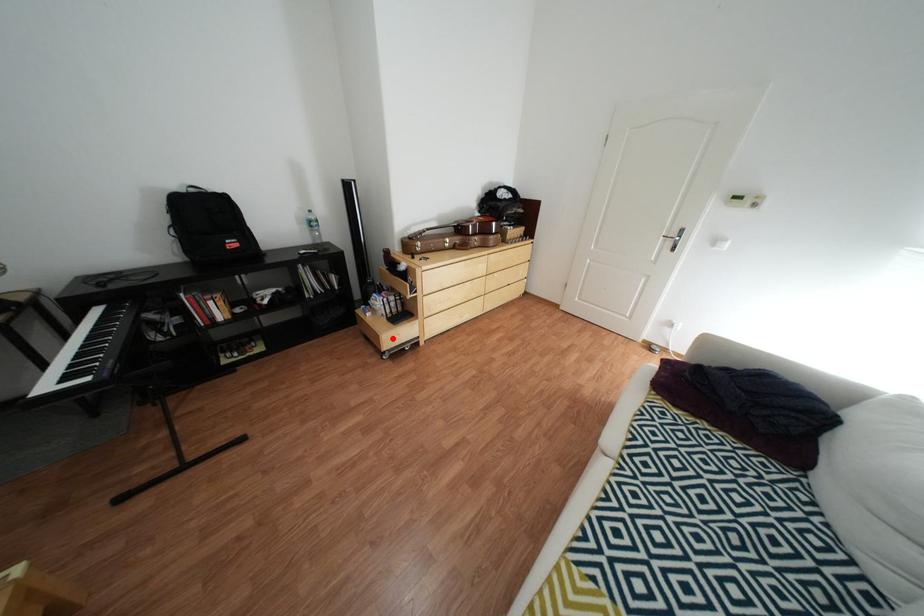
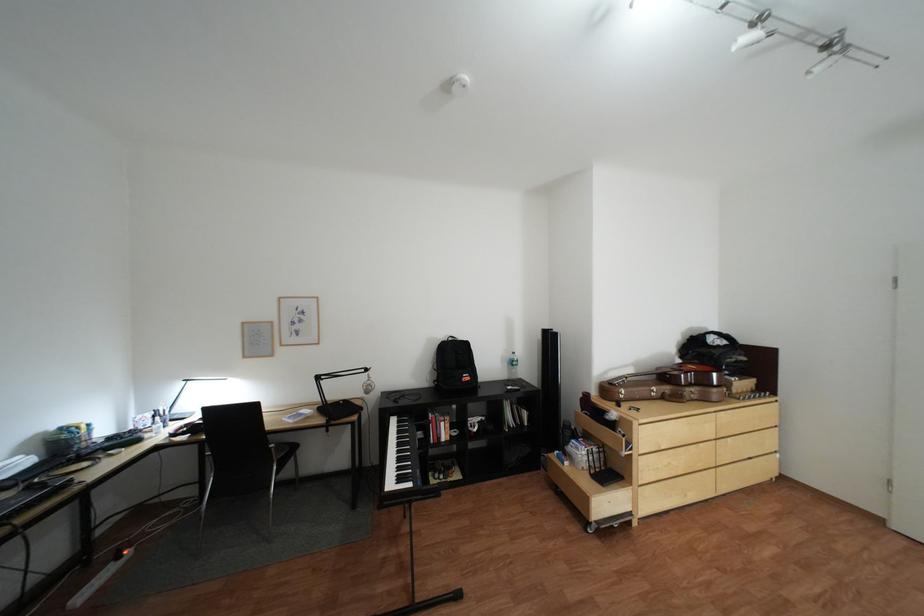
Question: I am providing you with two images of the same scene from different viewpoints. A red point is shown in image1. For the corresponding object point in image2, is it positioned nearer or farther from the camera?

Choices:
 (A) Nearer
 (B) Farther

Answer: (B)